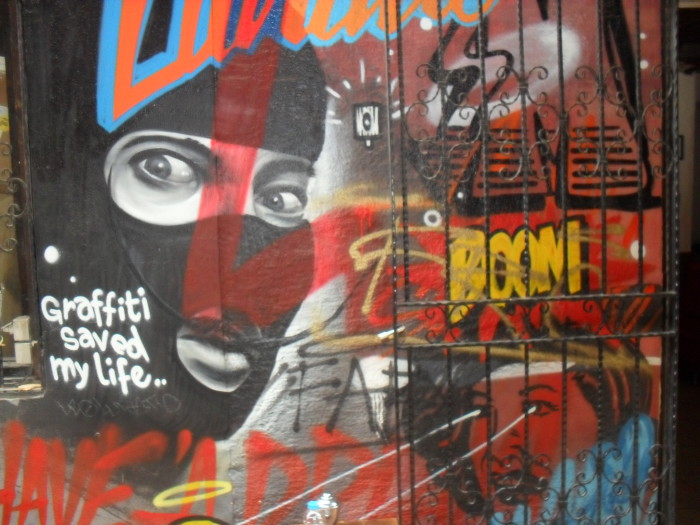
I want to click on bars, so click(512, 300).